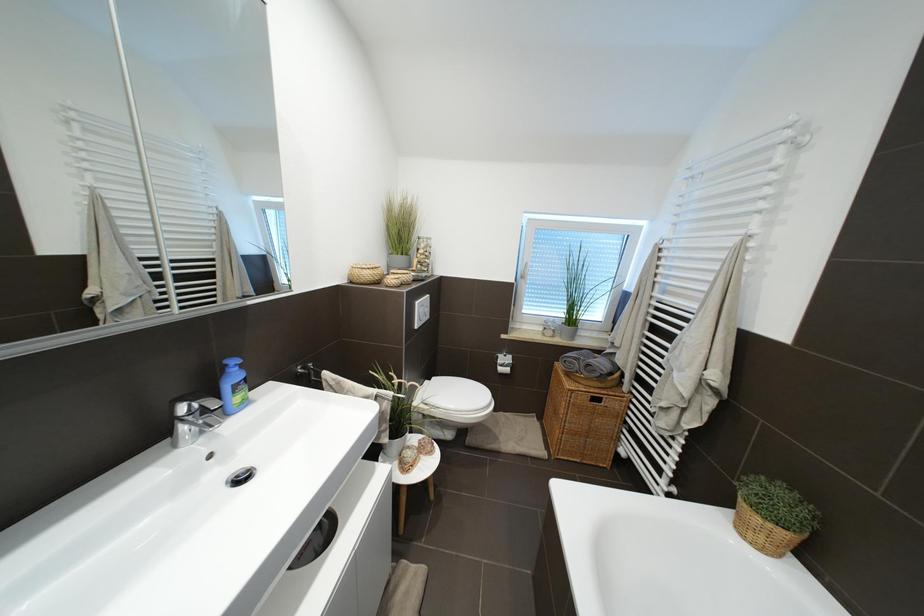
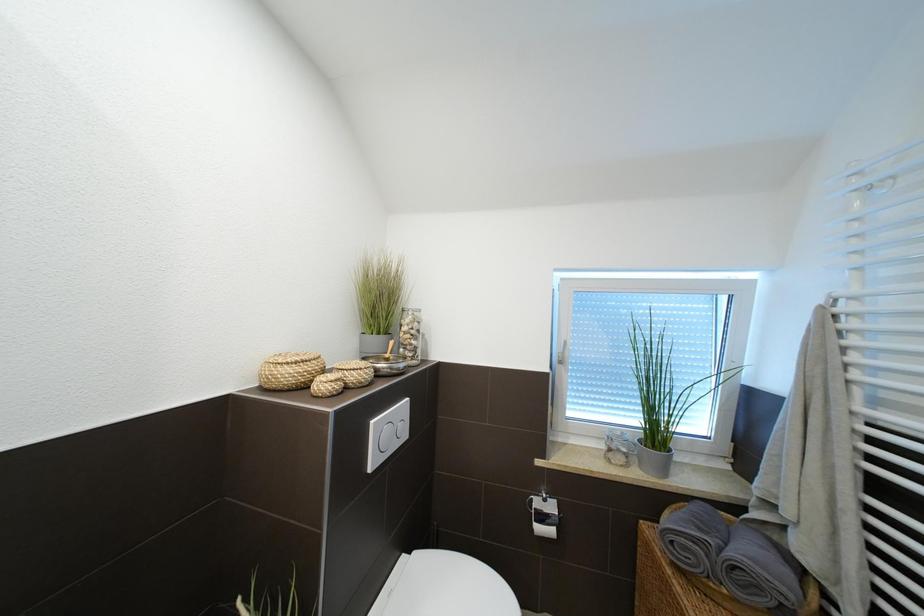
Question: How did the camera likely rotate?

Choices:
 (A) Left
 (B) Right
 (C) Up
 (D) Down

Answer: (C)